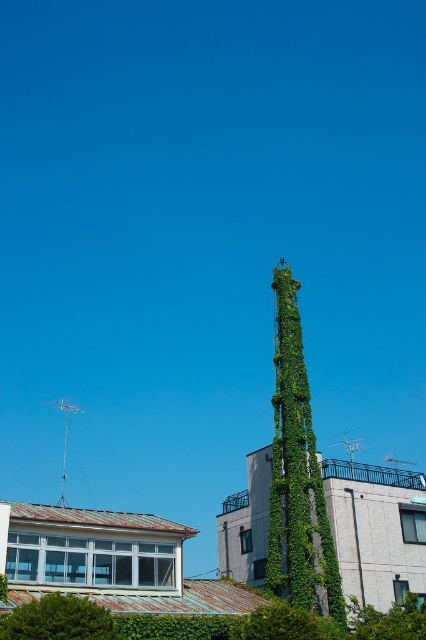
Can you confirm if green ivy-covered tower at center is thinner than green leafy tree at lower right?

Yes, green ivy-covered tower at center is thinner than green leafy tree at lower right.

Is point (279, 444) positioned in front of point (405, 611)?

No, (279, 444) is behind (405, 611).

At what (x,y) coordinates should I click in order to perform the action: click on green ivy-covered tower at center. Please return your answer as a coordinate pair (x, y). The width and height of the screenshot is (426, 640). Looking at the image, I should click on (296, 472).

Is point (282, 360) positioned in front of point (85, 625)?

No.

Is green ivy-covered tower at center bigger than green leafy tree at lower left?

Yes, green ivy-covered tower at center is bigger than green leafy tree at lower left.

Between point (299, 314) and point (114, 636), which one is positioned behind?

The point (299, 314) is behind.

The image size is (426, 640). In order to click on green ivy-covered tower at center in this screenshot , I will do click(296, 472).

Is green leafy tree at lower left thinner than green leafy tree at lower right?

Yes, green leafy tree at lower left is thinner than green leafy tree at lower right.

The width and height of the screenshot is (426, 640). Describe the element at coordinates (58, 620) in the screenshot. I see `green leafy tree at lower left` at that location.

Identify the location of green leafy tree at lower left. (58, 620).